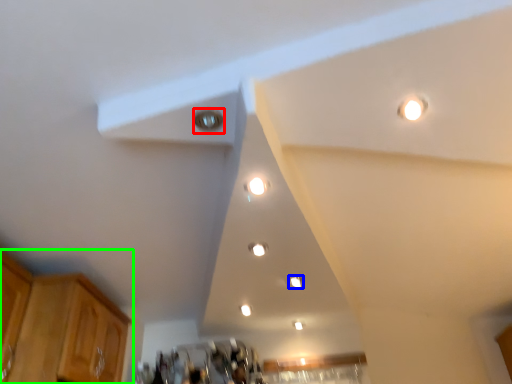
Question: Based on their relative distances, which object is farther from light (highlighted by a red box)? Choose from dot (highlighted by a blue box) and cabinetry (highlighted by a green box).

Choices:
 (A) dot
 (B) cabinetry

Answer: (B)